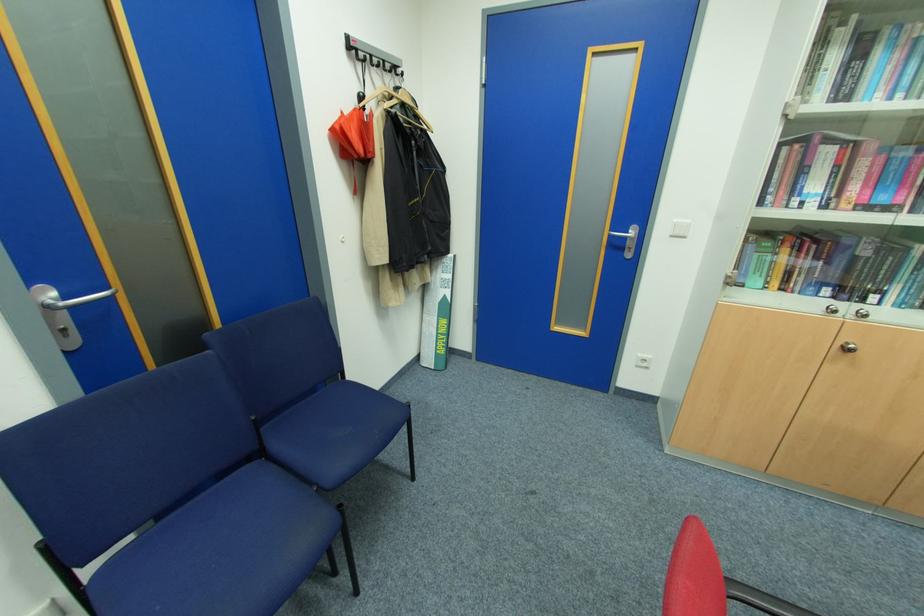
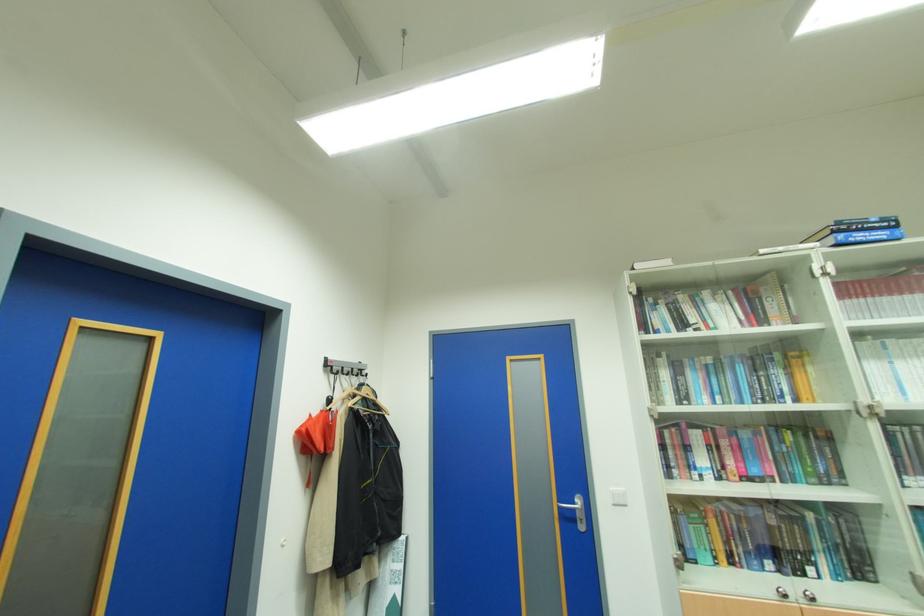
Question: How did the camera likely rotate?

Choices:
 (A) Left
 (B) Right
 (C) Up
 (D) Down

Answer: (C)